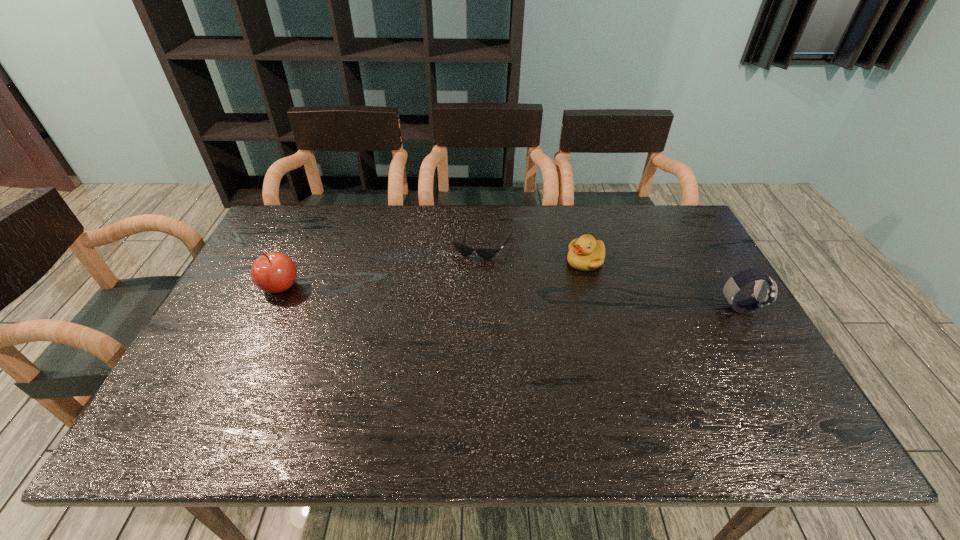
Find the location of `free space on the desktop that is between the leftmost object and the watch and is positioned at the beak of the third object from left to right`. free space on the desktop that is between the leftmost object and the watch and is positioned at the beak of the third object from left to right is located at coordinates (496, 296).

This screenshot has width=960, height=540. What are the coordinates of `free spot on the desktop that is between the apple and the rightmost object and is positioned on the front-facing side of the second object from left to right` in the screenshot? It's located at (461, 295).